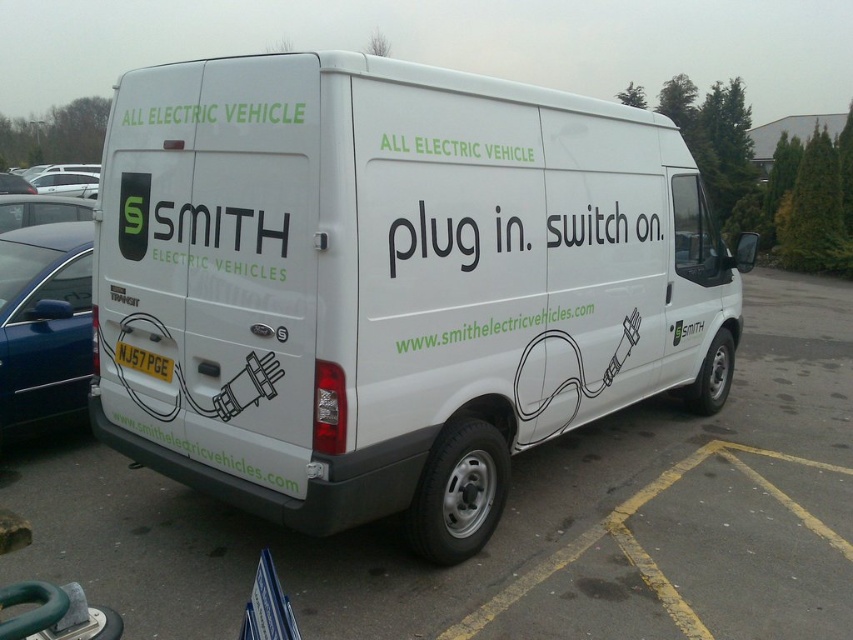
You are a parking attendant who needs to fit both the white matte van at center and the matte black car at left into a narrow parking spot. The spot is only wide enough for one vehicle. Based on their widths, which vehicle can you park in the spot?

The white matte van at center is wider than the matte black car at left. Therefore, the matte black car at left can be parked in the narrow spot since it is narrower than the van.

You are a pedestrian standing in the parking lot and want to cross from the white van at center to the matte black car at left. Which vehicle will you pass first?

The white van at center is closer to the viewer than the matte black car at left, so you will pass the white van at center first before reaching the matte black car at left.

You are standing next to a loading dock and need to load a box that is 3 meters long onto the white matte van at center. Can the box fit in the space between you and the van?

The distance between you and the white matte van at center is 3.06 meters, so the 3 meter long box can fit in the space between you and the van.